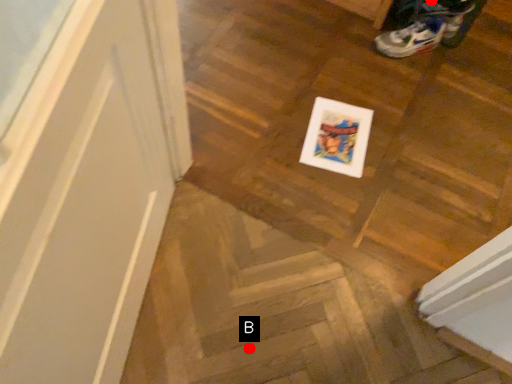
Question: Two points are circled on the image, labeled by A and B beside each circle. Which point is farther from the camera taking this photo?

Choices:
 (A) A is further
 (B) B is further

Answer: (A)